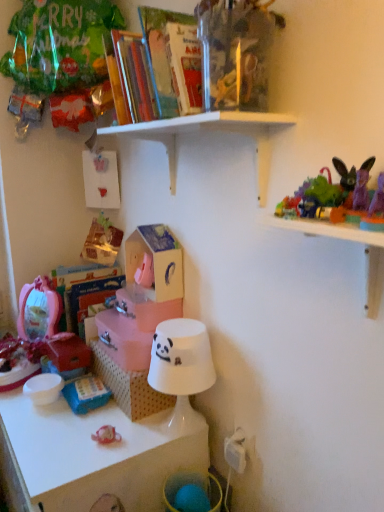
Find the location of `vacant space underneath white matte lampshade at center (from a real-world perspective)`. vacant space underneath white matte lampshade at center (from a real-world perspective) is located at coordinates (182, 426).